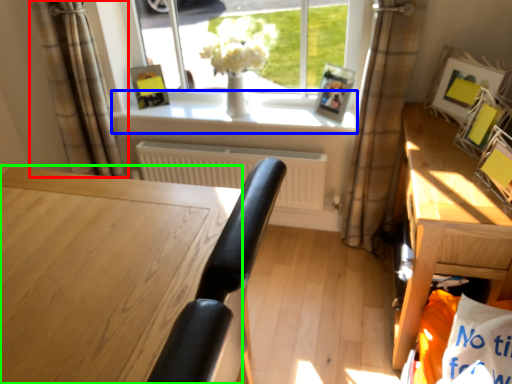
Question: Estimate the real-world distances between objects in this image. Which object is closer to curtain (highlighted by a red box), window sill (highlighted by a blue box) or desk (highlighted by a green box)?

Choices:
 (A) window sill
 (B) desk

Answer: (A)